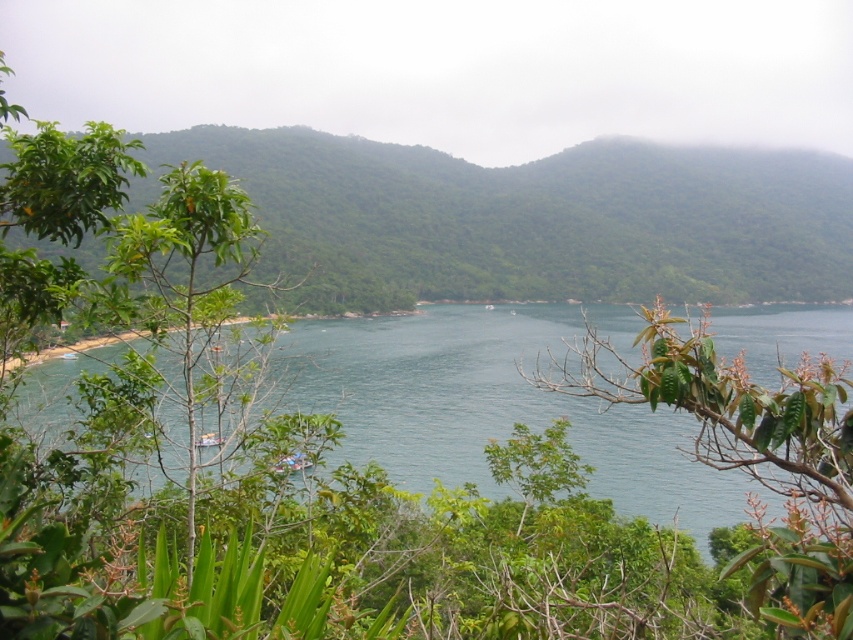
You are standing at the edge of a cliff overlooking the green leafy forest at center. If you want to throw a pebble to reach the forest floor, will it travel more than 7 meters horizontally?

The green leafy forest at center is 6.96 meters away from the viewer. Since the distance is just under 7 meters, the pebble would travel less than 7 meters horizontally to reach the forest floor.

You are standing at the point marked by the coordinates point (532, 220) in the image. What type of vegetation do you see around you?

The point (532, 220) indicates green leafy forest at center, so you are surrounded by green leafy forest.

You are standing on a cliff overlooking the clear blue water at center and the green leafy branch at center. You want to throw a pebble to hit both objects. Which one should you aim for first, the one closer to you or the one farther away?

The distance between clear blue water at center and green leafy branch at center is 35.04 feet. To hit both with a single pebble, you should aim for the closer object first because the pebble will naturally fall downward as it travels, making it hit the closer object first before reaching the farther one.